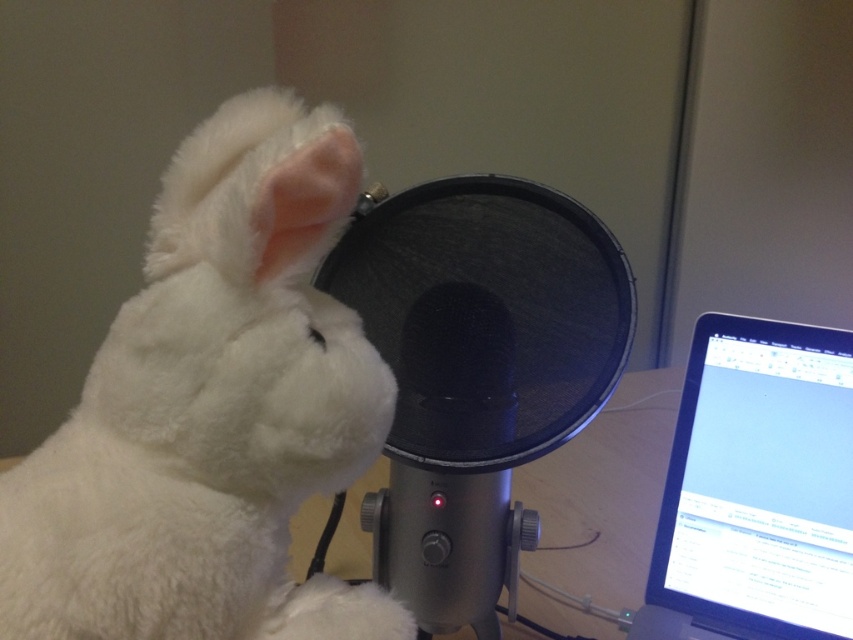
Which is behind, point (251, 168) or point (718, 518)?

Positioned behind is point (718, 518).

Can you confirm if white plush rabbit at upper left is wider than silver metallic laptop at right?

Yes, white plush rabbit at upper left is wider than silver metallic laptop at right.

Is point (257, 417) more distant than point (726, 403)?

No, (257, 417) is closer to viewer.

Where is `white plush rabbit at upper left`? white plush rabbit at upper left is located at coordinates (212, 410).

Can you confirm if metallic black microphone at center is smaller than silver metallic laptop at right?

Actually, metallic black microphone at center might be larger than silver metallic laptop at right.

At what (x,y) coordinates should I click in order to perform the action: click on metallic black microphone at center. Please return your answer as a coordinate pair (x, y). The width and height of the screenshot is (853, 640). Looking at the image, I should click on (477, 372).

You are a GUI agent. You are given a task and a screenshot of the screen. Output one action in this format:
    pyautogui.click(x=<x>, y=<y>)
    Task: Click on the metallic black microphone at center
    Image resolution: width=853 pixels, height=640 pixels.
    Given the screenshot: What is the action you would take?
    pyautogui.click(x=477, y=372)

Is white plush rabbit at upper left shorter than metallic black microphone at center?

Indeed, white plush rabbit at upper left has a lesser height compared to metallic black microphone at center.

The width and height of the screenshot is (853, 640). Describe the element at coordinates (212, 410) in the screenshot. I see `white plush rabbit at upper left` at that location.

This screenshot has width=853, height=640. I want to click on white plush rabbit at upper left, so click(212, 410).